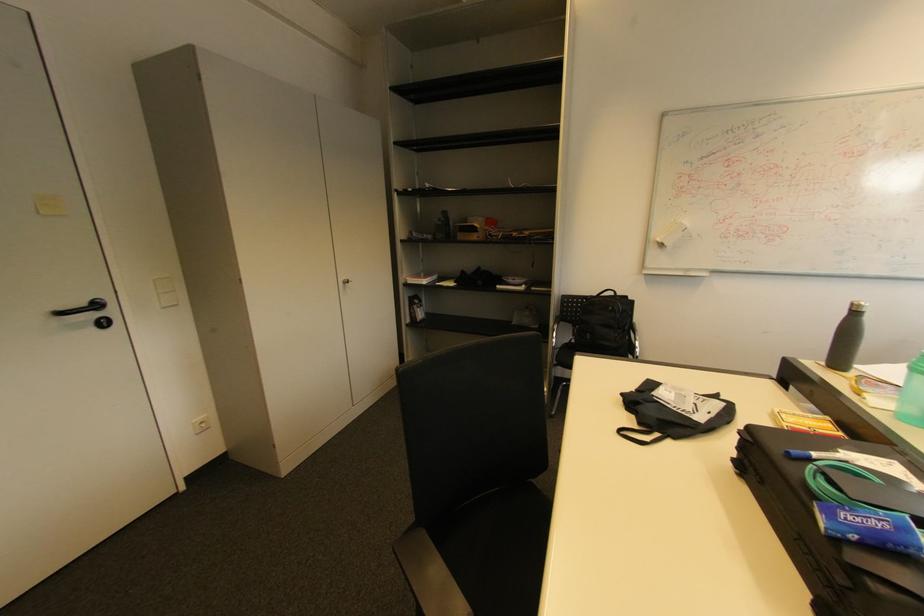
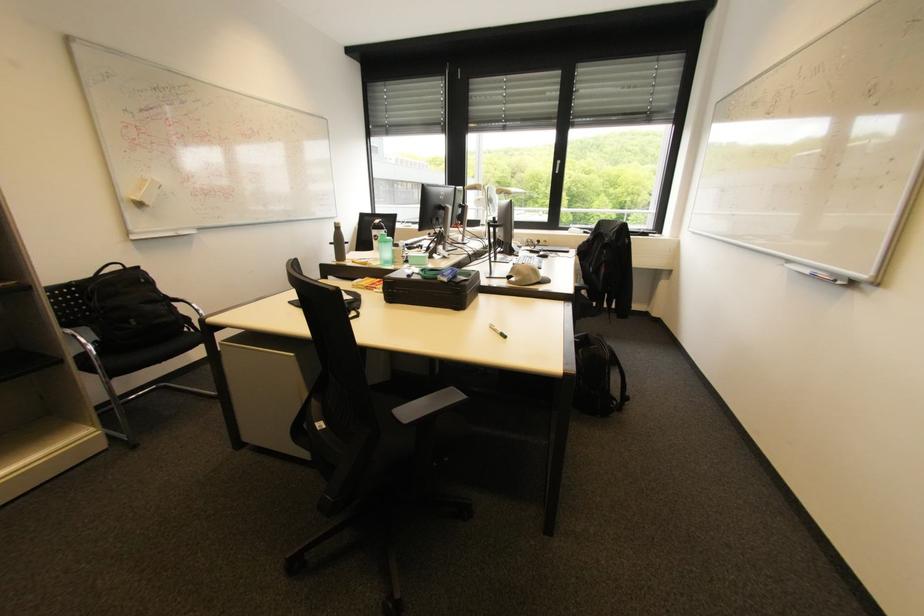
Locate, in the second image, the point that corresponds to (x=561, y=328) in the first image.

(74, 331)